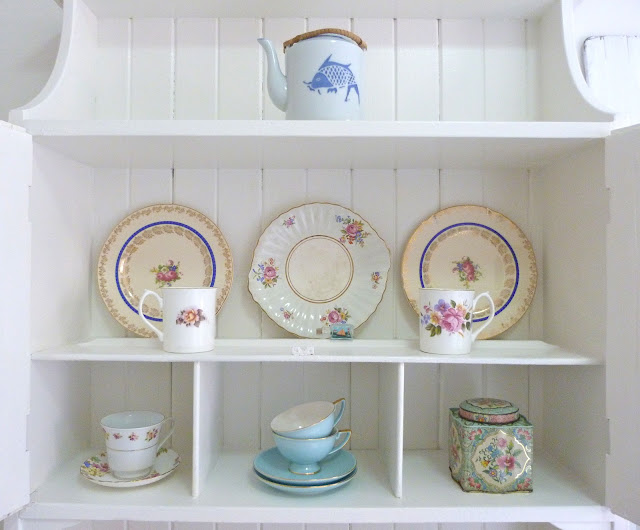
Where is `tea pot`? Image resolution: width=640 pixels, height=530 pixels. tea pot is located at coordinates (326, 58).